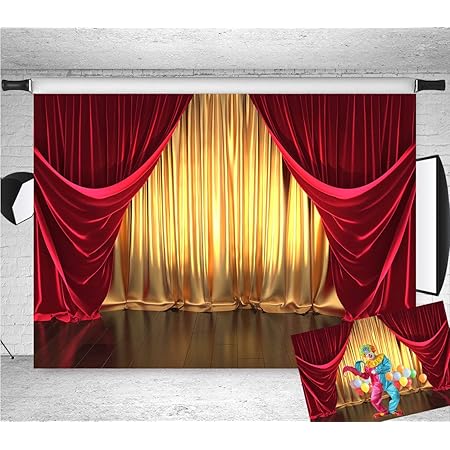
Identify the location of light diffuser. (17, 203), (426, 220).